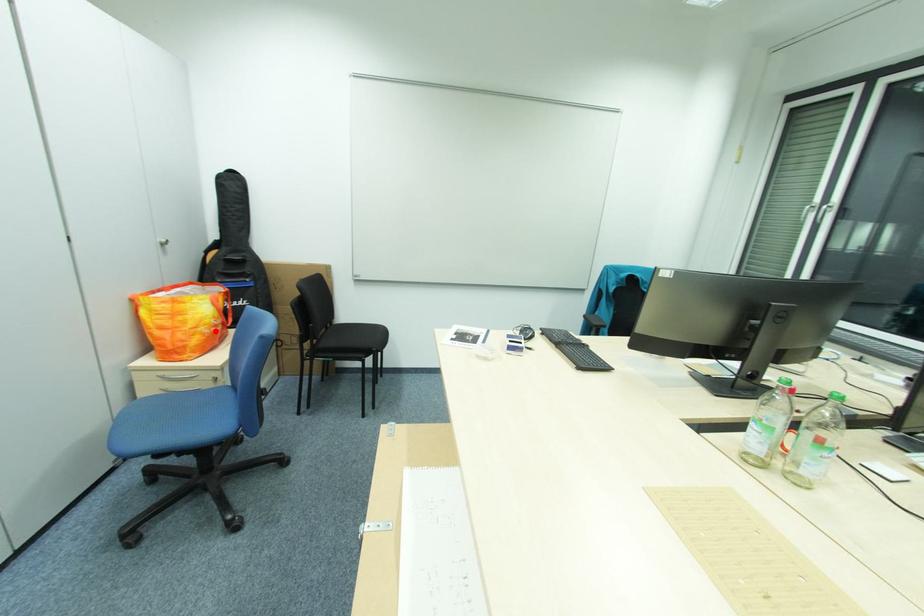
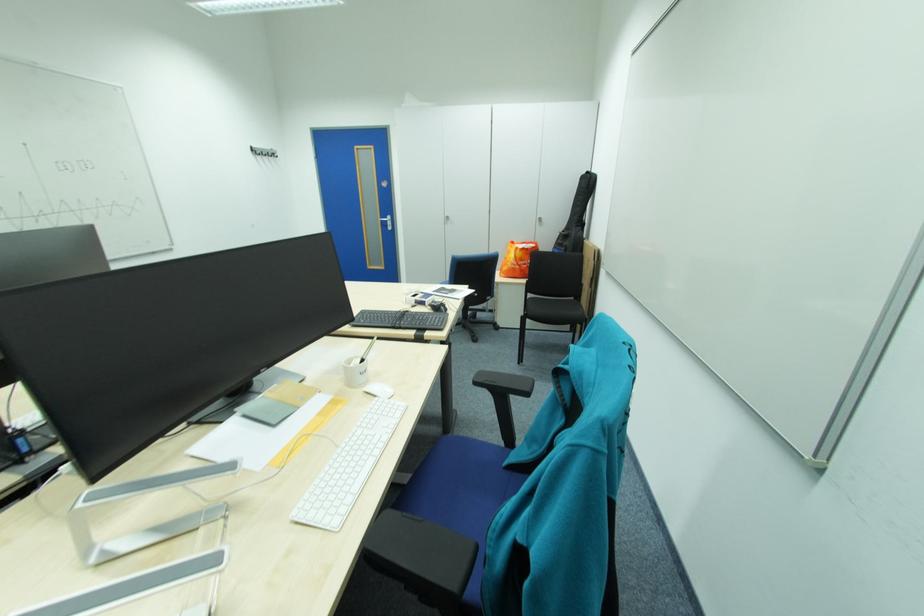
Question: I am providing you with two images of the same scene from different viewpoints. Image1 has a red point marked. In image2, the corresponding 3D location appears at what relative position? Reply with the corresponding letter.

Choices:
 (A) Closer
 (B) Farther

Answer: (B)